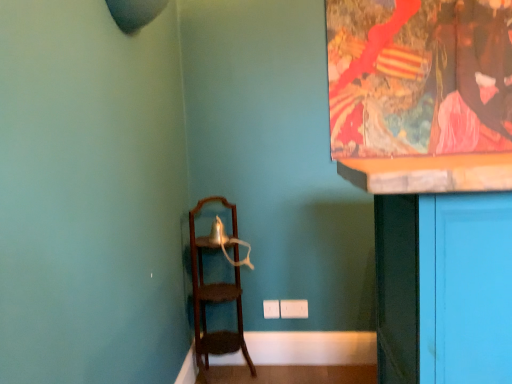
Question: Considering the relative sizes of wooden frame at upper right and wooden ladder at left in the image provided, is wooden frame at upper right taller than wooden ladder at left?

Choices:
 (A) yes
 (B) no

Answer: (B)

Question: Is wooden frame at upper right aimed at wooden ladder at left?

Choices:
 (A) no
 (B) yes

Answer: (A)

Question: Can you confirm if wooden frame at upper right is positioned to the left of wooden ladder at left?

Choices:
 (A) no
 (B) yes

Answer: (A)

Question: Does wooden frame at upper right appear on the right side of wooden ladder at left?

Choices:
 (A) yes
 (B) no

Answer: (A)

Question: Does wooden frame at upper right have a larger size compared to wooden ladder at left?

Choices:
 (A) no
 (B) yes

Answer: (A)

Question: Is wooden frame at upper right turned away from wooden ladder at left?

Choices:
 (A) yes
 (B) no

Answer: (B)

Question: From the image's perspective, would you say wooden ladder at left is positioned over wooden frame at upper right?

Choices:
 (A) no
 (B) yes

Answer: (A)

Question: From a real-world perspective, is wooden ladder at left on top of wooden frame at upper right?

Choices:
 (A) no
 (B) yes

Answer: (A)

Question: Can you confirm if wooden ladder at left is positioned to the right of wooden frame at upper right?

Choices:
 (A) yes
 (B) no

Answer: (B)

Question: Is wooden ladder at left not inside wooden frame at upper right?

Choices:
 (A) yes
 (B) no

Answer: (A)

Question: Is wooden ladder at left with wooden frame at upper right?

Choices:
 (A) yes
 (B) no

Answer: (B)

Question: Does wooden ladder at left have a larger size compared to wooden frame at upper right?

Choices:
 (A) no
 (B) yes

Answer: (B)

Question: From the image's perspective, is wooden ladder at left positioned above or below wooden frame at upper right?

Choices:
 (A) below
 (B) above

Answer: (A)